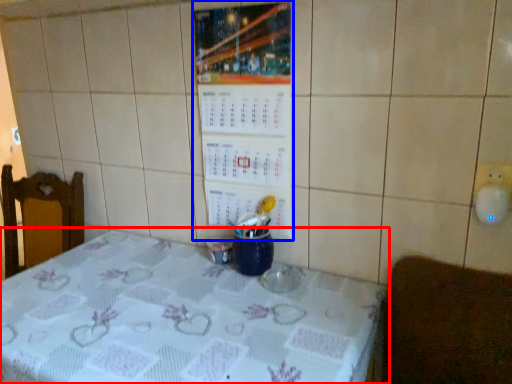
Question: Which of the following is the farthest to the observer, table (highlighted by a red box) or bulletin board (highlighted by a blue box)?

Choices:
 (A) table
 (B) bulletin board

Answer: (B)